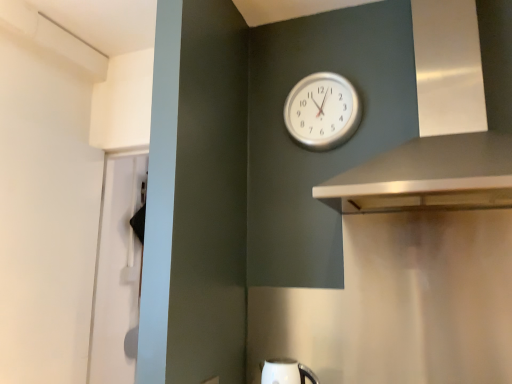
Question: Which is correct: silver metallic vent at upper right is inside silver metallic clock at upper center, or outside of it?

Choices:
 (A) outside
 (B) inside

Answer: (A)

Question: Is silver metallic vent at upper right wider or thinner than silver metallic clock at upper center?

Choices:
 (A) wide
 (B) thin

Answer: (A)

Question: Which object is the farthest from the white glossy kettle at lower center?

Choices:
 (A) silver metallic vent at upper right
 (B) silver metallic clock at upper center

Answer: (B)

Question: Estimate the real-world distances between objects in this image. Which object is farther from the silver metallic clock at upper center?

Choices:
 (A) white glossy kettle at lower center
 (B) silver metallic vent at upper right

Answer: (A)